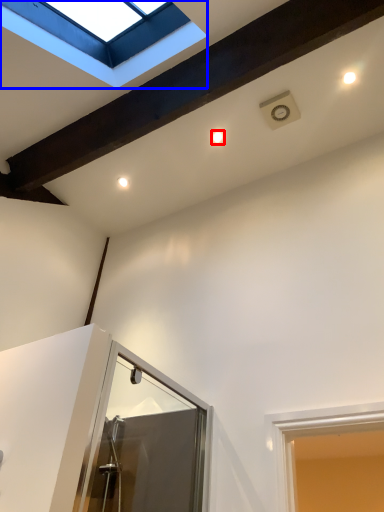
Question: Which of the following is the farthest to the observer, droplight (highlighted by a red box) or window (highlighted by a blue box)?

Choices:
 (A) droplight
 (B) window

Answer: (A)